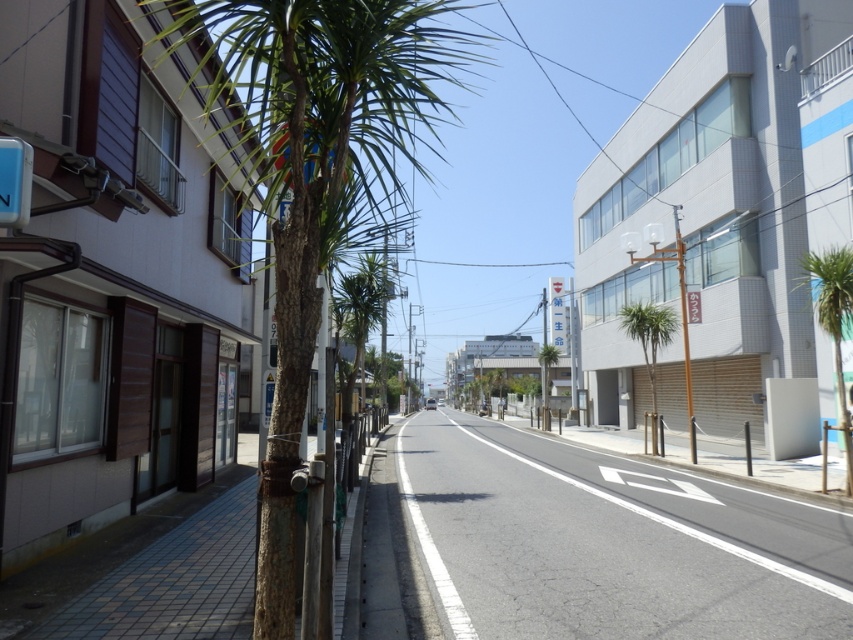
Question: Does green textured palm tree at left appear under green leafy palm tree at right?

Choices:
 (A) no
 (B) yes

Answer: (A)

Question: Is brown brick pavement at lower left above green leafy palm tree at center?

Choices:
 (A) yes
 (B) no

Answer: (A)

Question: Which object is the closest to the green leafy palm tree at center-right?

Choices:
 (A) green leafy palm tree at center
 (B) metallic blue sign at upper left

Answer: (A)

Question: Is brown brick pavement at lower left above green leafy palm tree at right?

Choices:
 (A) yes
 (B) no

Answer: (B)

Question: Which object is positioned farthest from the green textured palm tree at left?

Choices:
 (A) metallic blue sign at upper left
 (B) green leafy palm tree at right

Answer: (B)

Question: Which object is farther from the camera taking this photo?

Choices:
 (A) metallic blue sign at upper left
 (B) green leafy palm tree at right
 (C) gray asphalt road at center

Answer: (B)